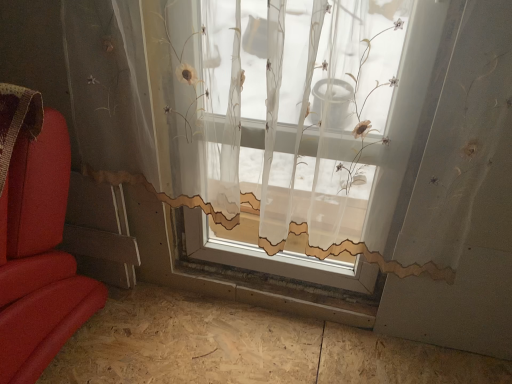
Question: Considering the positions of translucent fabric window at center and light brown plywood at lower left in the image, is translucent fabric window at center bigger or smaller than light brown plywood at lower left?

Choices:
 (A) big
 (B) small

Answer: (A)

Question: From a real-world perspective, is translucent fabric window at center physically located above or below light brown plywood at lower left?

Choices:
 (A) above
 (B) below

Answer: (A)

Question: In terms of height, does translucent fabric window at center look taller or shorter compared to light brown plywood at lower left?

Choices:
 (A) short
 (B) tall

Answer: (B)

Question: Is light brown plywood at lower left wider or thinner than translucent fabric window at center?

Choices:
 (A) thin
 (B) wide

Answer: (B)

Question: From their relative heights in the image, would you say light brown plywood at lower left is taller or shorter than translucent fabric window at center?

Choices:
 (A) short
 (B) tall

Answer: (A)

Question: In the image, is light brown plywood at lower left positioned in front of or behind translucent fabric window at center?

Choices:
 (A) front
 (B) behind

Answer: (B)

Question: Considering the positions of light brown plywood at lower left and translucent fabric window at center in the image, is light brown plywood at lower left bigger or smaller than translucent fabric window at center?

Choices:
 (A) small
 (B) big

Answer: (A)